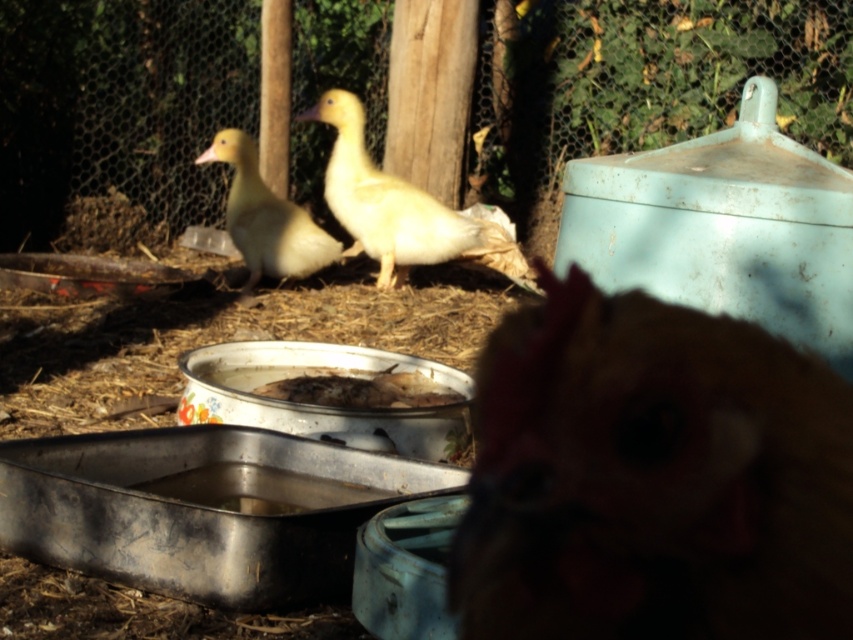
Question: Estimate the real-world distances between objects in this image. Which object is closer to the white matte duck at center?

Choices:
 (A) brown feathered chicken at center
 (B) yellow downy duckling at center

Answer: (B)

Question: Can you confirm if brown feathered chicken at center is positioned to the left of white matte duck at center?

Choices:
 (A) no
 (B) yes

Answer: (A)

Question: Can you confirm if brown feathered chicken at center is positioned to the left of white matte duck at center?

Choices:
 (A) yes
 (B) no

Answer: (B)

Question: Which object appears closest to the camera in this image?

Choices:
 (A) yellow downy duckling at center
 (B) white matte duck at center
 (C) brown feathered chicken at center

Answer: (C)

Question: Does brown feathered chicken at center have a larger size compared to white matte duck at center?

Choices:
 (A) yes
 (B) no

Answer: (B)

Question: Estimate the real-world distances between objects in this image. Which object is farther from the brown feathered chicken at center?

Choices:
 (A) white matte duck at center
 (B) yellow downy duckling at center

Answer: (B)